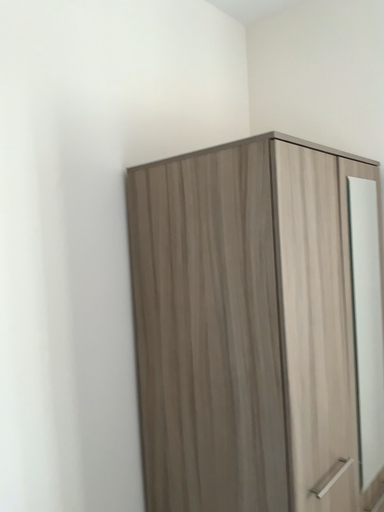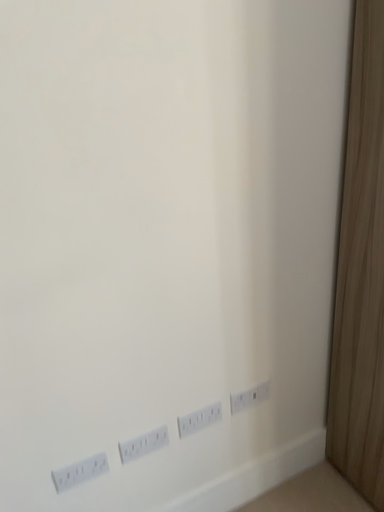
Question: How did the camera likely rotate when shooting the video?

Choices:
 (A) rotated left
 (B) rotated right

Answer: (A)